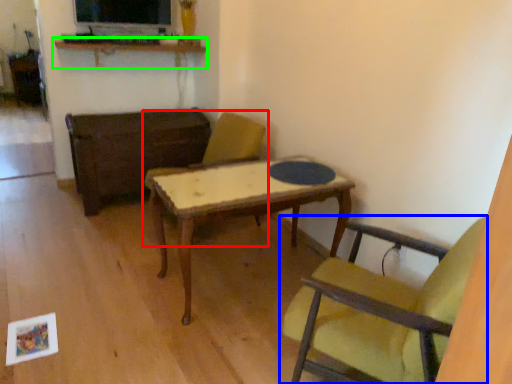
Question: Estimate the real-world distances between objects in this image. Which object is closer to chair (highlighted by a red box), chair (highlighted by a blue box) or shelf (highlighted by a green box)?

Choices:
 (A) chair
 (B) shelf

Answer: (B)